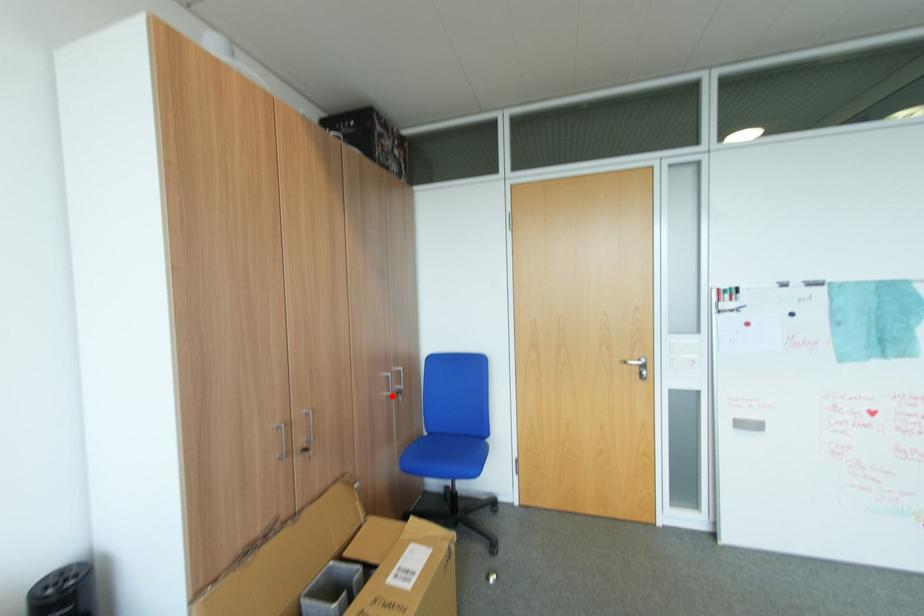
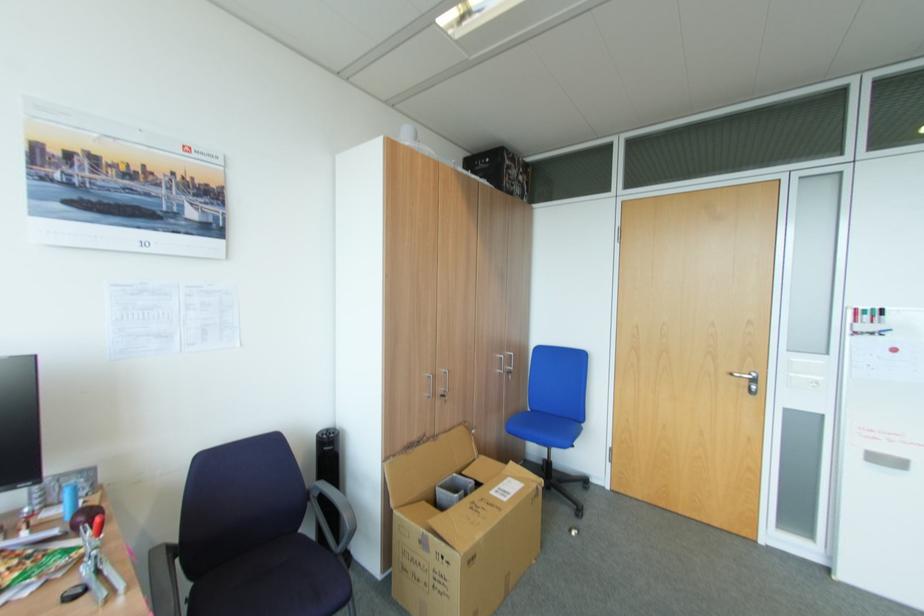
Question: I am providing you with two images of the same scene from different viewpoints. A red point is marked on the first image. At the location where the point appears in image 1, is it still visible in image 2?

Choices:
 (A) Yes
 (B) No

Answer: (A)